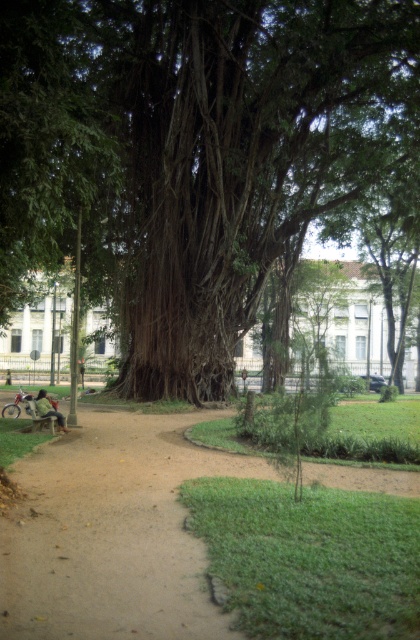
Question: Which point is farther from the camera taking this photo?

Choices:
 (A) [x=55, y=412]
 (B) [x=267, y=106]
 (C) [x=228, y=465]

Answer: (B)

Question: Which object is the farthest from the green fabric jacket at lower left?

Choices:
 (A) brown dirt path at lower left
 (B) wooden park bench at lower left
 (C) green leafy tree at center

Answer: (C)

Question: Does green leafy tree at center come behind green fabric jacket at lower left?

Choices:
 (A) no
 (B) yes

Answer: (A)

Question: Is brown dirt path at lower left to the right of wooden park bench at lower left from the viewer's perspective?

Choices:
 (A) no
 (B) yes

Answer: (B)

Question: Among these objects, which one is nearest to the camera?

Choices:
 (A) green leafy tree at center
 (B) wooden park bench at lower left

Answer: (A)

Question: Can you confirm if wooden park bench at lower left is thinner than green fabric jacket at lower left?

Choices:
 (A) yes
 (B) no

Answer: (B)